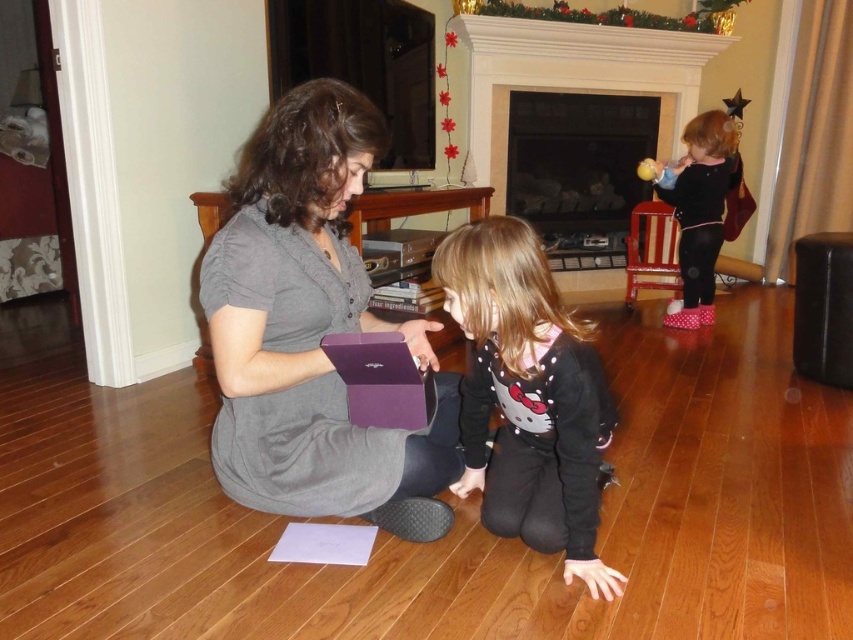
You are a guest at a Christmas party and see the black matte sweater at center and the black velvet dress at upper right. Which one is positioned lower in the image?

The black matte sweater at center is located below the black velvet dress at upper right, so it is positioned lower in the image.

You are standing in the living room and want to place a small decoration on the point closer to you between point [496,365] and point [693,269]. Which point should you choose?

You should choose point [496,365] because it is closer to the viewer than point [693,269].